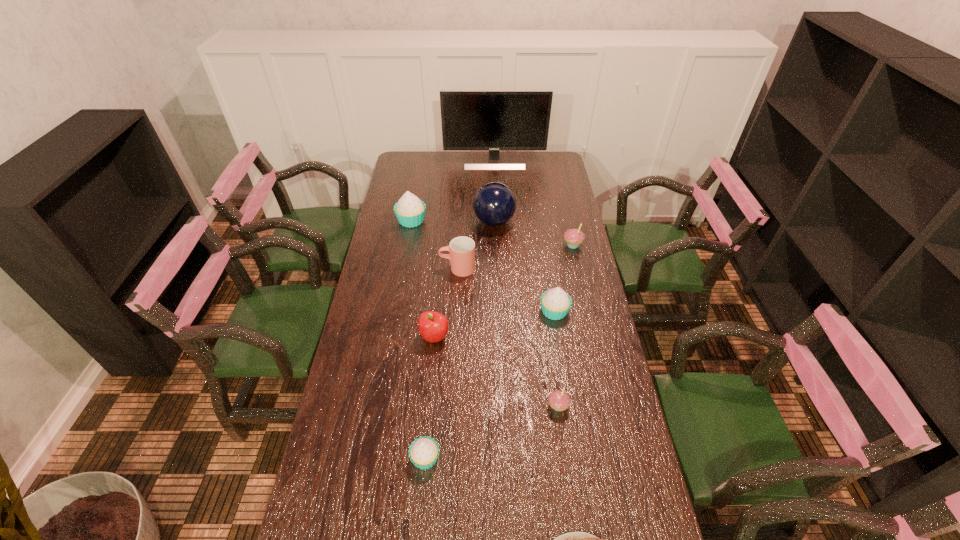
This screenshot has height=540, width=960. I want to click on the farthest object, so click(x=493, y=120).

This screenshot has width=960, height=540. Find the location of `monitor`. monitor is located at coordinates (493, 120).

The height and width of the screenshot is (540, 960). Identify the location of blue bowling ball. (494, 204).

Where is `the ninth shortest object`? the ninth shortest object is located at coordinates (494, 204).

I want to click on the leftmost object, so click(410, 210).

I want to click on the leftmost cupcake, so click(410, 210).

Image resolution: width=960 pixels, height=540 pixels. What are the coordinates of `cup` in the screenshot? It's located at (462, 249).

The height and width of the screenshot is (540, 960). In order to click on the bigger pink cupcake in this screenshot , I will do pyautogui.click(x=574, y=237).

Locate an element on the screen. the fourth nearest cupcake is located at coordinates (574, 237).

At what (x,y) coordinates should I click in order to perform the action: click on the second biggest white cupcake. Please return your answer as a coordinate pair (x, y). Looking at the image, I should click on (555, 303).